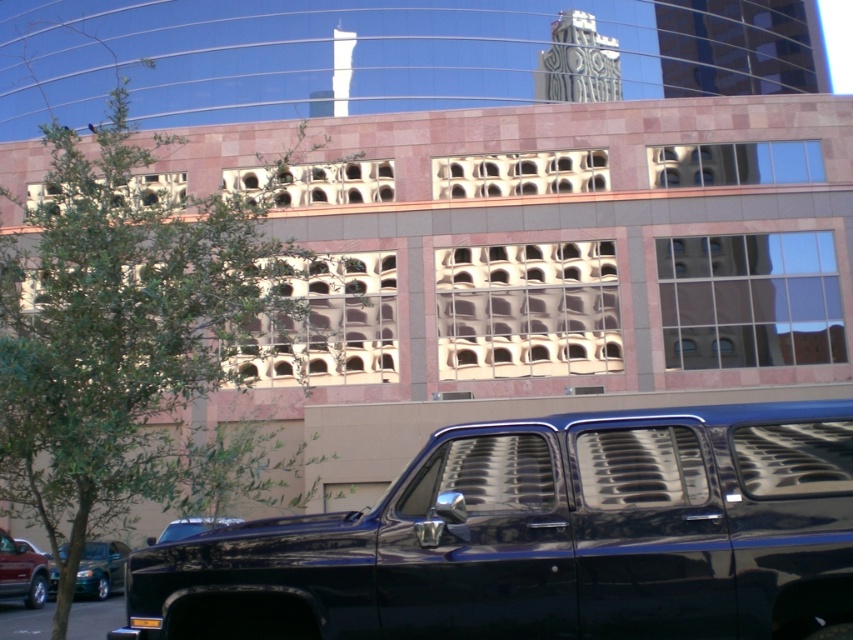
Question: Does metallic green sedan at lower left appear on the left side of metallic red suv at lower left?

Choices:
 (A) yes
 (B) no

Answer: (B)

Question: Based on their relative distances, which object is farther from the glossy black truck at lower center?

Choices:
 (A) metallic red suv at lower left
 (B) shiny black truck at lower center
 (C) metallic green sedan at lower left

Answer: (A)

Question: Is green leafy tree at upper left wider than metallic red suv at lower left?

Choices:
 (A) yes
 (B) no

Answer: (A)

Question: Which point is farther from the camera taking this photo?

Choices:
 (A) (163, 536)
 (B) (3, 568)
 (C) (207, 321)

Answer: (A)

Question: Which of the following is the farthest from the observer?

Choices:
 (A) green leafy tree at upper left
 (B) metallic red suv at lower left
 (C) shiny black truck at lower center
 (D) glossy black truck at lower center

Answer: (B)

Question: Is glossy black truck at lower center above shiny black truck at lower center?

Choices:
 (A) yes
 (B) no

Answer: (A)